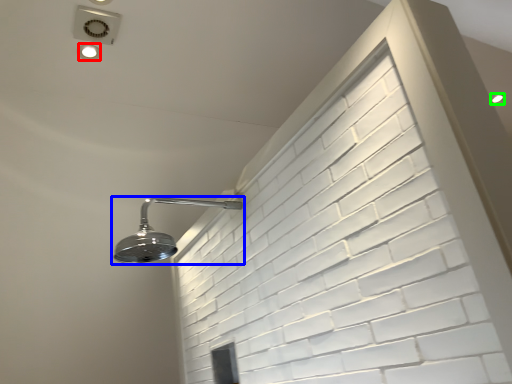
Question: Considering the real-world distances, which object is farthest from droplight (highlighted by a red box)? shower (highlighted by a blue box) or droplight (highlighted by a green box)?

Choices:
 (A) shower
 (B) droplight

Answer: (B)